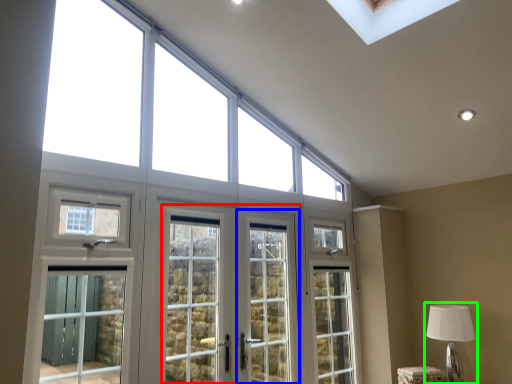
Question: Which object is the farthest from screen door (highlighted by a red box)? Choose among these: screen door (highlighted by a blue box) or table lamp (highlighted by a green box).

Choices:
 (A) screen door
 (B) table lamp

Answer: (B)